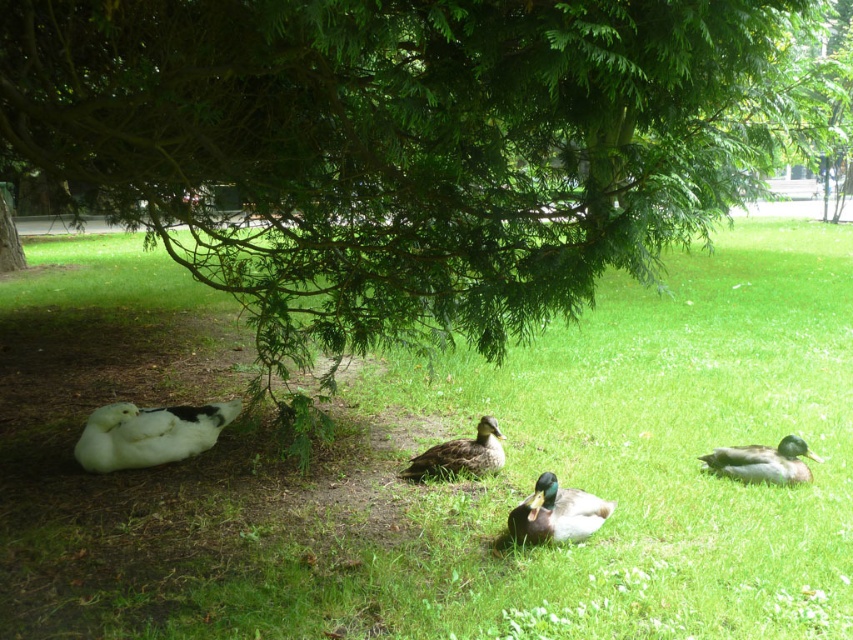
Is green glossy duck at center bigger than green glossy duck at lower right?

Indeed, green glossy duck at center has a larger size compared to green glossy duck at lower right.

Can you confirm if green glossy duck at center is positioned below green glossy duck at lower right?

Yes, green glossy duck at center is below green glossy duck at lower right.

Where is `green glossy duck at center`? The height and width of the screenshot is (640, 853). green glossy duck at center is located at coordinates (556, 513).

Does green leafy tree at center have a greater width compared to white fluffy duck at left?

Correct, the width of green leafy tree at center exceeds that of white fluffy duck at left.

Is point (259, 211) less distant than point (207, 426)?

Yes, point (259, 211) is in front of point (207, 426).

Identify the location of green leafy tree at center. The width and height of the screenshot is (853, 640). (403, 150).

Is green leafy tree at center to the right of green glossy duck at lower right from the viewer's perspective?

No, green leafy tree at center is not to the right of green glossy duck at lower right.

Is green leafy tree at center shorter than green glossy duck at lower right?

Incorrect, green leafy tree at center's height does not fall short of green glossy duck at lower right's.

The width and height of the screenshot is (853, 640). What do you see at coordinates (403, 150) in the screenshot?
I see `green leafy tree at center` at bounding box center [403, 150].

You are a GUI agent. You are given a task and a screenshot of the screen. Output one action in this format:
    pyautogui.click(x=<x>, y=<y>)
    Task: Click on the green leafy tree at center
    
    Given the screenshot: What is the action you would take?
    pyautogui.click(x=403, y=150)